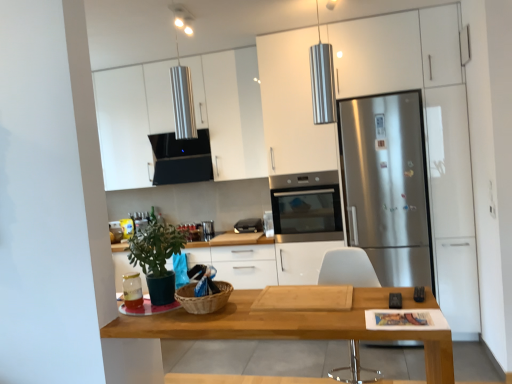
The height and width of the screenshot is (384, 512). Identify the location of space that is in front of black plastic remote control at lower center, marked as the 1th appliance in a front-to-back arrangement. (412, 322).